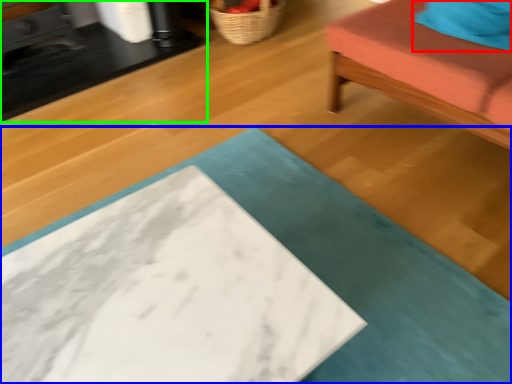
Question: Which is farther away from pillow (highlighted by a red box)? table (highlighted by a blue box) or table (highlighted by a green box)?

Choices:
 (A) table
 (B) table

Answer: (B)